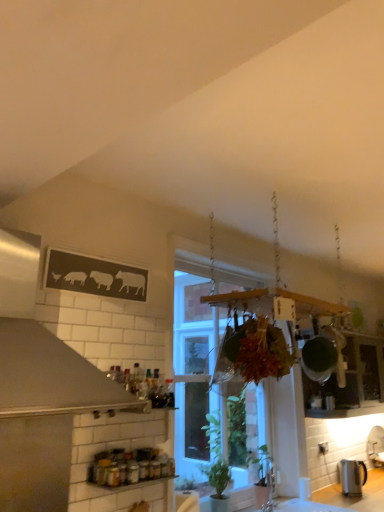
Question: Considering the relative sizes of clear glass window at center and metallic glass jars at lower center in the image provided, is clear glass window at center taller than metallic glass jars at lower center?

Choices:
 (A) yes
 (B) no

Answer: (A)

Question: Can you confirm if clear glass window at center is wider than metallic glass jars at lower center?

Choices:
 (A) yes
 (B) no

Answer: (A)

Question: Could you tell me if clear glass window at center is turned towards metallic glass jars at lower center?

Choices:
 (A) yes
 (B) no

Answer: (B)

Question: Can metallic glass jars at lower center be found inside clear glass window at center?

Choices:
 (A) yes
 (B) no

Answer: (B)

Question: Is clear glass window at center not near metallic glass jars at lower center?

Choices:
 (A) yes
 (B) no

Answer: (A)

Question: Considering the positions of clear glass window at center and satin silver exhaust hood at upper left in the image, is clear glass window at center wider or thinner than satin silver exhaust hood at upper left?

Choices:
 (A) wide
 (B) thin

Answer: (B)

Question: Is clear glass window at center in front of or behind satin silver exhaust hood at upper left in the image?

Choices:
 (A) front
 (B) behind

Answer: (B)

Question: From a real-world perspective, is clear glass window at center physically located above or below satin silver exhaust hood at upper left?

Choices:
 (A) above
 (B) below

Answer: (B)

Question: Is clear glass window at center spatially inside satin silver exhaust hood at upper left, or outside of it?

Choices:
 (A) outside
 (B) inside

Answer: (A)

Question: In terms of height, does clear glass window at center look taller or shorter compared to satin silver kettle at lower right?

Choices:
 (A) tall
 (B) short

Answer: (A)

Question: Is clear glass window at center to the left or to the right of satin silver kettle at lower right in the image?

Choices:
 (A) left
 (B) right

Answer: (A)

Question: Is clear glass window at center wider or thinner than satin silver kettle at lower right?

Choices:
 (A) thin
 (B) wide

Answer: (B)

Question: From the image's perspective, relative to satin silver kettle at lower right, is clear glass window at center above or below?

Choices:
 (A) above
 (B) below

Answer: (A)

Question: Considering the relative positions of satin silver exhaust hood at upper left and clear glass window at center in the image provided, is satin silver exhaust hood at upper left to the left or to the right of clear glass window at center?

Choices:
 (A) right
 (B) left

Answer: (B)

Question: Is point [82, 382] positioned closer to the camera than point [198, 402]?

Choices:
 (A) farther
 (B) closer

Answer: (B)